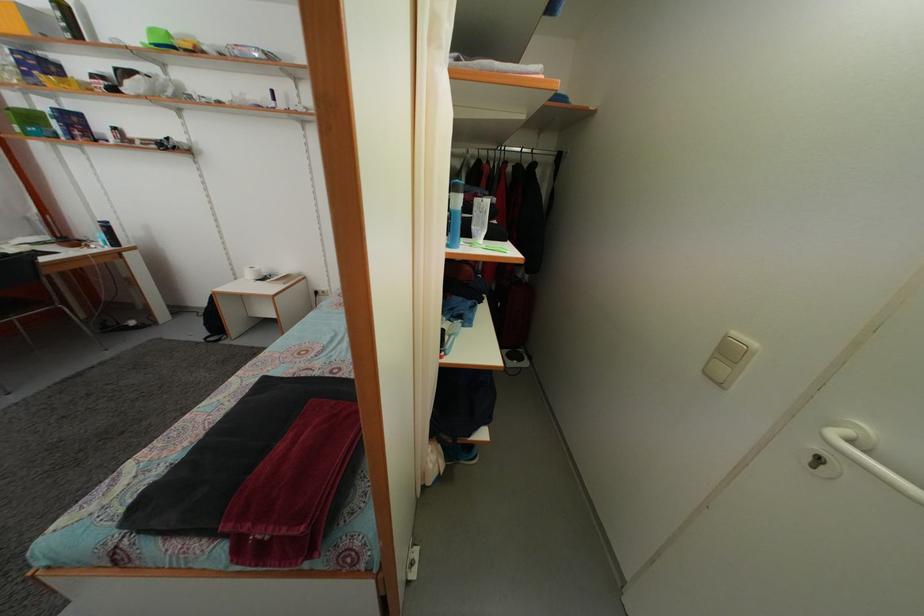
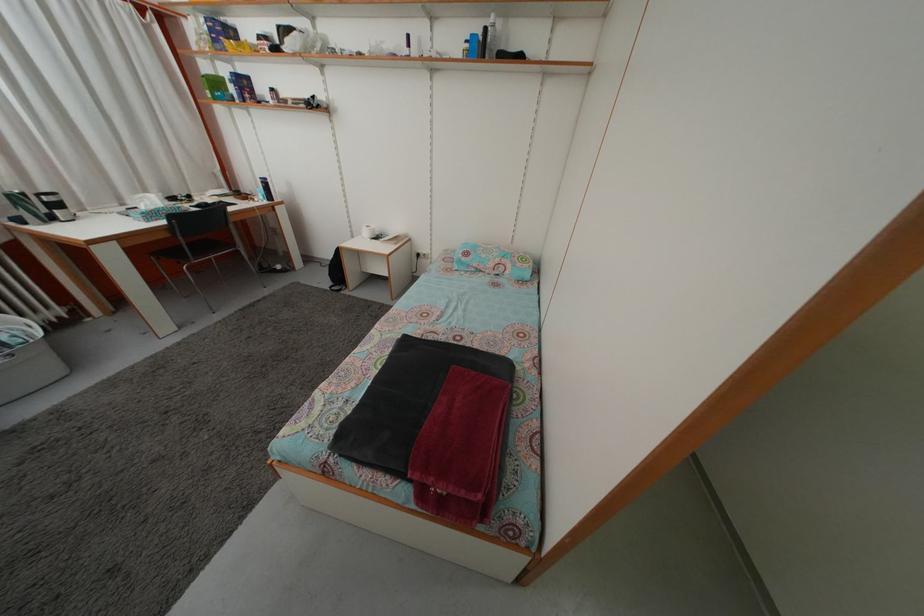
Locate, in the second image, the point that corresponds to point 105,244 in the first image.

(266, 199)